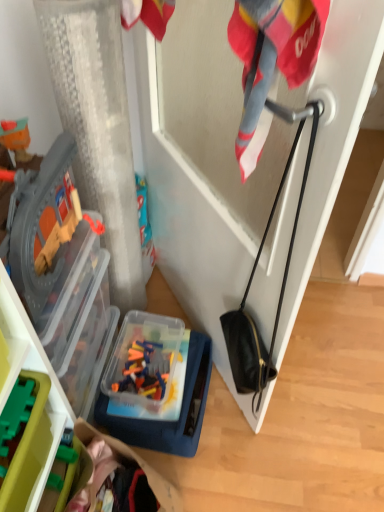
Find the location of a particular element. The height and width of the screenshot is (512, 384). spots to the right of translucent plastic container at lower center is located at coordinates (262, 426).